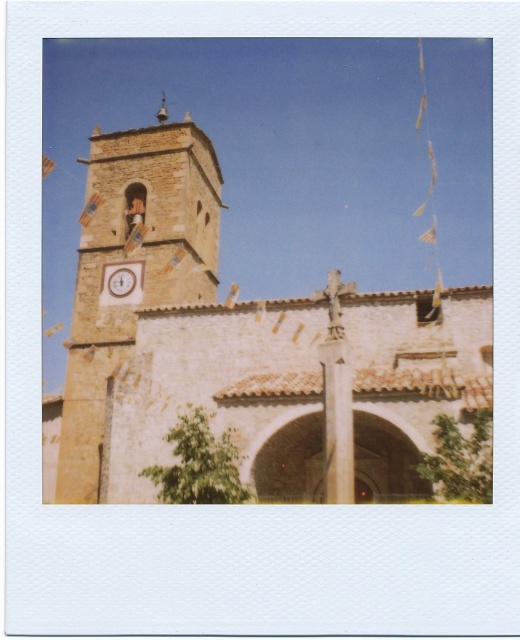
Question: Which point is closer to the camera?

Choices:
 (A) 331,384
 (B) 120,292
 (C) 305,320
 (D) 108,244

Answer: (A)

Question: Does white stone statue at center have a lesser width compared to matte brown clock at center-left?

Choices:
 (A) no
 (B) yes

Answer: (A)

Question: Is beige stone church at center to the left of white stone statue at center from the viewer's perspective?

Choices:
 (A) no
 (B) yes

Answer: (B)

Question: Which of the following is the closest to the observer?

Choices:
 (A) (110, 292)
 (B) (314, 424)
 (C) (68, 348)

Answer: (B)

Question: Which object is positioned farthest from the white stone statue at center?

Choices:
 (A) beige stone clock tower at left
 (B) matte brown clock at center-left
 (C) beige stone church at center

Answer: (A)

Question: Does beige stone church at center appear on the left side of beige stone clock tower at left?

Choices:
 (A) yes
 (B) no

Answer: (B)